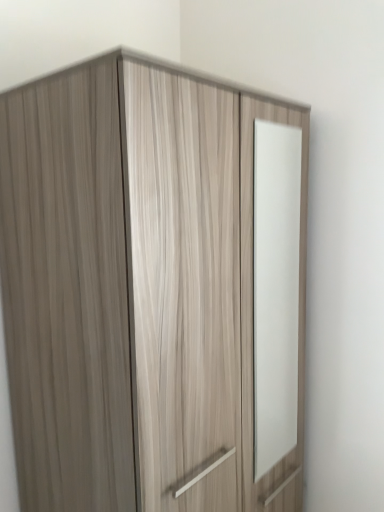
The image size is (384, 512). Describe the element at coordinates (141, 292) in the screenshot. I see `wooden wardrobe at center` at that location.

Where is `wooden wardrobe at center`? The image size is (384, 512). wooden wardrobe at center is located at coordinates (141, 292).

At what (x,y) coordinates should I click in order to perform the action: click on wooden wardrobe at center. Please return your answer as a coordinate pair (x, y). Looking at the image, I should click on coord(141,292).